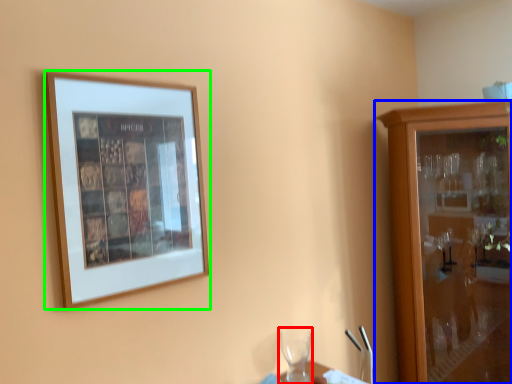
Question: Based on their relative distances, which object is nearer to wine glass (highlighted by a red box)? Choose from cabinetry (highlighted by a blue box) and picture frame (highlighted by a green box).

Choices:
 (A) cabinetry
 (B) picture frame

Answer: (A)